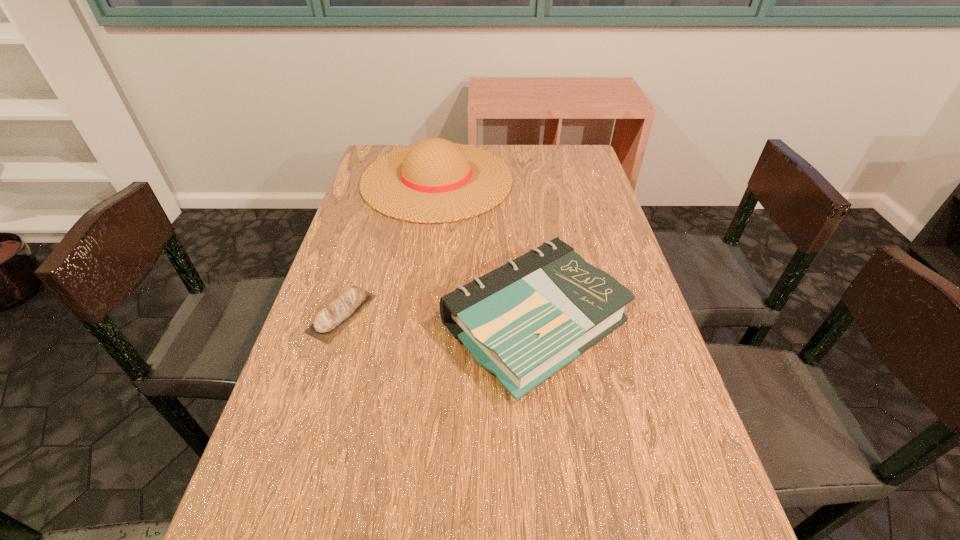
At what (x,y) coordinates should I click in order to perform the action: click on object present at the right edge. Please return your answer as a coordinate pair (x, y). This screenshot has height=540, width=960. Looking at the image, I should click on (524, 321).

What are the coordinates of `object at the far left corner` in the screenshot? It's located at [435, 181].

The image size is (960, 540). In the image, there is a desktop. What are the coordinates of `vacant space at the far edge` in the screenshot? It's located at (498, 146).

Identify the location of vacant region at the left edge. The image size is (960, 540). (354, 226).

You are a GUI agent. You are given a task and a screenshot of the screen. Output one action in this format:
    pyautogui.click(x=<x>, y=<y>)
    Task: Click on the vacant space at the right edge
    
    Given the screenshot: What is the action you would take?
    pyautogui.click(x=628, y=321)

Where is `vacant space that's between the shortest object and the paperback book`? Image resolution: width=960 pixels, height=540 pixels. vacant space that's between the shortest object and the paperback book is located at coordinates (438, 319).

Where is `empty location between the tallest object and the pita bread`? Image resolution: width=960 pixels, height=540 pixels. empty location between the tallest object and the pita bread is located at coordinates (390, 247).

Where is `blank region between the paperback book and the bonnet`? blank region between the paperback book and the bonnet is located at coordinates (485, 252).

Find the location of a particular element. Image resolution: width=960 pixels, height=540 pixels. vacant area between the tallest object and the paperback book is located at coordinates (485, 252).

Locate an element on the screen. This screenshot has height=540, width=960. empty space between the pita bread and the tallest object is located at coordinates (390, 247).